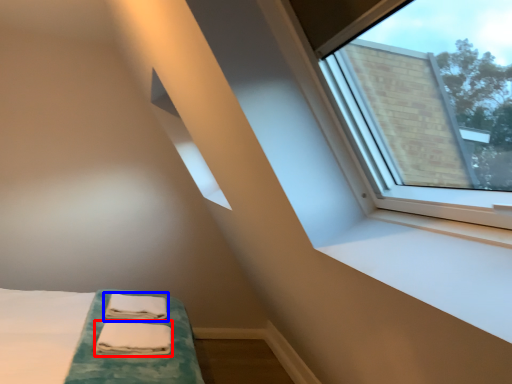
Question: Which object appears farthest to the camera in this image, sheet (highlighted by a red box) or bath towel (highlighted by a blue box)?

Choices:
 (A) sheet
 (B) bath towel

Answer: (B)